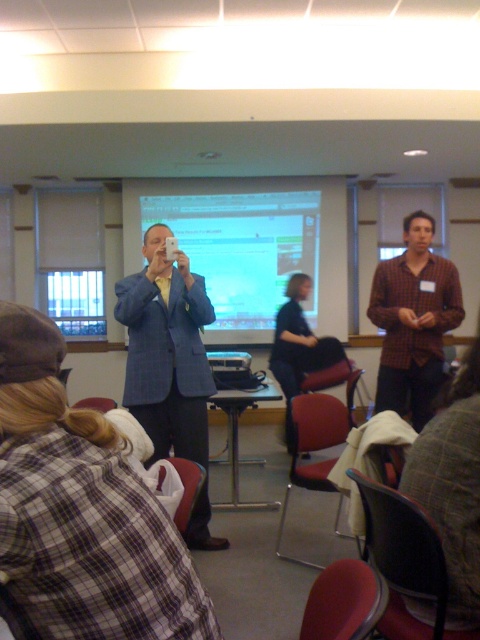
Between point (408, 406) and point (229, 369), which one is positioned in front?

Point (408, 406) is in front.

Is point (455, 296) farther from camera compared to point (235, 356)?

No, (455, 296) is in front of (235, 356).

Is point (430, 236) positioned before point (216, 371)?

Yes, it is.

Locate an element on the screen. This screenshot has width=480, height=640. plaid shirt at center is located at coordinates (414, 321).

Is point (166, 209) more distant than point (240, 364)?

Yes, point (166, 209) is behind point (240, 364).

Where is `matte white projector screen at center`? This screenshot has height=640, width=480. matte white projector screen at center is located at coordinates click(x=243, y=248).

Measure the distance between matte white projector screen at center and camera.

6.31 meters

Identify the location of matte white projector screen at center. The width and height of the screenshot is (480, 640). (243, 248).

Does blue textured blazer at center appear on the right side of plaid shirt at center?

No, blue textured blazer at center is not to the right of plaid shirt at center.

Is blue textured blazer at center above plaid shirt at center?

Incorrect, blue textured blazer at center is not positioned above plaid shirt at center.

Identify the location of blue textured blazer at center. (169, 364).